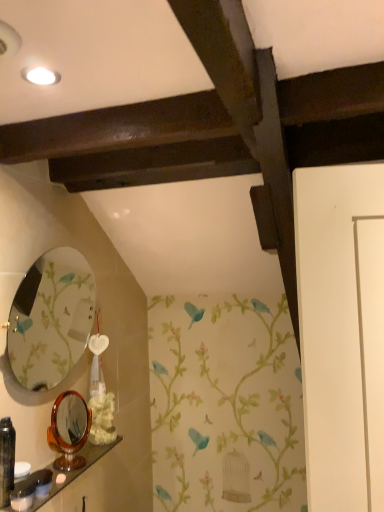
Question: From the image's perspective, does matte black toiletry at lower left, placed as the third toiletry when sorted from left to right, appear lower than matte glass mirror at left, which is the 2th mirror in bottom-to-top order?

Choices:
 (A) no
 (B) yes

Answer: (B)

Question: Does matte black toiletry at lower left, the first toiletry when ordered from right to left, have a smaller size compared to matte glass mirror at left, which ranks as the 1th mirror in top-to-bottom order?

Choices:
 (A) no
 (B) yes

Answer: (B)

Question: From a real-world perspective, is matte black toiletry at lower left, the first toiletry when ordered from right to left, on matte glass mirror at left, which is the 2th mirror in bottom-to-top order?

Choices:
 (A) no
 (B) yes

Answer: (A)

Question: Is matte black toiletry at lower left, placed as the third toiletry when sorted from left to right, positioned behind matte glass mirror at left, which is the 2th mirror in bottom-to-top order?

Choices:
 (A) no
 (B) yes

Answer: (B)

Question: Is matte black toiletry at lower left, the first toiletry when ordered from right to left, bigger than matte glass mirror at left, which ranks as the 1th mirror in top-to-bottom order?

Choices:
 (A) no
 (B) yes

Answer: (A)

Question: Is matte black toiletry at lower left, the first toiletry when ordered from right to left, taller than matte glass mirror at left, which is the 2th mirror in bottom-to-top order?

Choices:
 (A) yes
 (B) no

Answer: (B)

Question: Considering the relative sizes of white glossy soap at lower left, acting as the second toiletry starting from the left, and matte glass mirror at left, which is the 2th mirror in bottom-to-top order, in the image provided, is white glossy soap at lower left, acting as the second toiletry starting from the left, taller than matte glass mirror at left, which is the 2th mirror in bottom-to-top order,?

Choices:
 (A) no
 (B) yes

Answer: (A)

Question: From a real-world perspective, is white glossy soap at lower left, which ranks as the second toiletry in right-to-left order, located higher than matte glass mirror at left, which ranks as the 1th mirror in top-to-bottom order?

Choices:
 (A) no
 (B) yes

Answer: (A)

Question: Can you confirm if white glossy soap at lower left, which ranks as the second toiletry in right-to-left order, is thinner than matte glass mirror at left, which is the 2th mirror in bottom-to-top order?

Choices:
 (A) no
 (B) yes

Answer: (B)

Question: From the image's perspective, does white glossy soap at lower left, acting as the second toiletry starting from the left, appear higher than matte glass mirror at left, which ranks as the 1th mirror in top-to-bottom order?

Choices:
 (A) yes
 (B) no

Answer: (B)

Question: Is white glossy soap at lower left, which ranks as the second toiletry in right-to-left order, not within matte glass mirror at left, which ranks as the 1th mirror in top-to-bottom order?

Choices:
 (A) yes
 (B) no

Answer: (A)

Question: Is the depth of white glossy soap at lower left, which ranks as the second toiletry in right-to-left order, less than that of matte glass mirror at left, which ranks as the 1th mirror in top-to-bottom order?

Choices:
 (A) no
 (B) yes

Answer: (B)

Question: From a real-world perspective, is white matte flower at lower center physically above white glossy soap at lower left, acting as the second toiletry starting from the left?

Choices:
 (A) no
 (B) yes

Answer: (B)